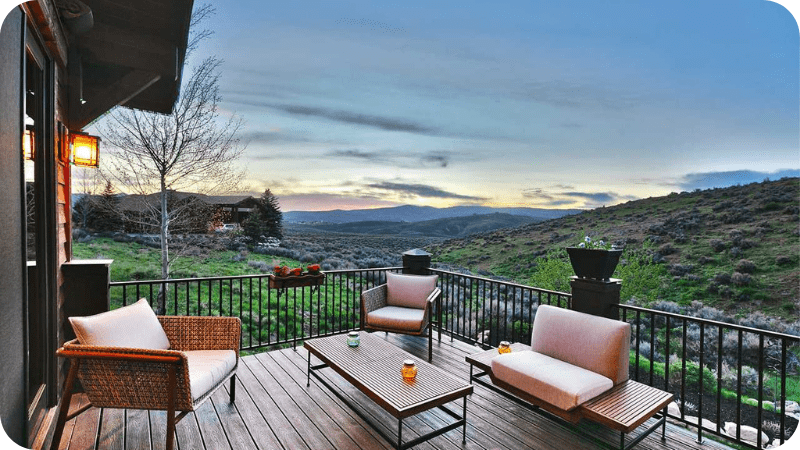
Locate an element on the screen. This screenshot has height=450, width=800. light is located at coordinates (85, 153).